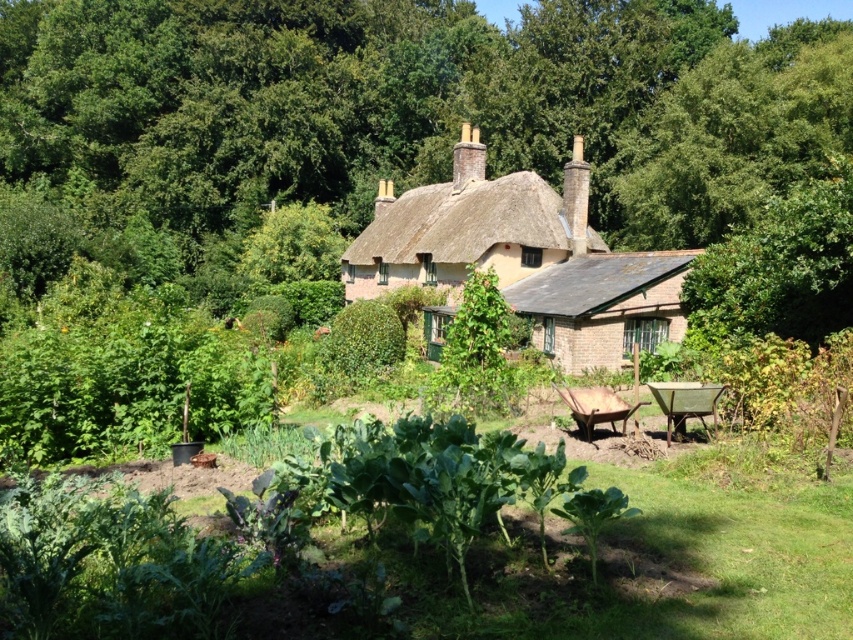
Is green leafy tree at center closer to the viewer compared to green leafy vegetables at center?

No, it is not.

Is green leafy tree at center above green leafy vegetables at center?

Yes.

At what (x,y) coordinates should I click in order to perform the action: click on green leafy tree at center. Please return your answer as a coordinate pair (x, y). The height and width of the screenshot is (640, 853). Looking at the image, I should click on (410, 108).

In the scene shown: Measure the distance between green leafy tree at center and camera.

green leafy tree at center is 120.90 feet from camera.

Does green leafy tree at center have a lesser height compared to brick cottage at center?

In fact, green leafy tree at center may be taller than brick cottage at center.

Is point (54, 122) positioned before point (599, 337)?

No, it is not.

Locate an element on the screen. The height and width of the screenshot is (640, 853). green leafy tree at center is located at coordinates (410, 108).

In the scene shown: Can you confirm if green leafy vegetables at center is thinner than brick cottage at center?

Yes, green leafy vegetables at center is thinner than brick cottage at center.

From the picture: Does green leafy vegetables at center lie behind brick cottage at center?

No, green leafy vegetables at center is in front of brick cottage at center.

Does point (386, 529) lie behind point (370, 294)?

That is False.

I want to click on green leafy vegetables at center, so click(x=646, y=564).